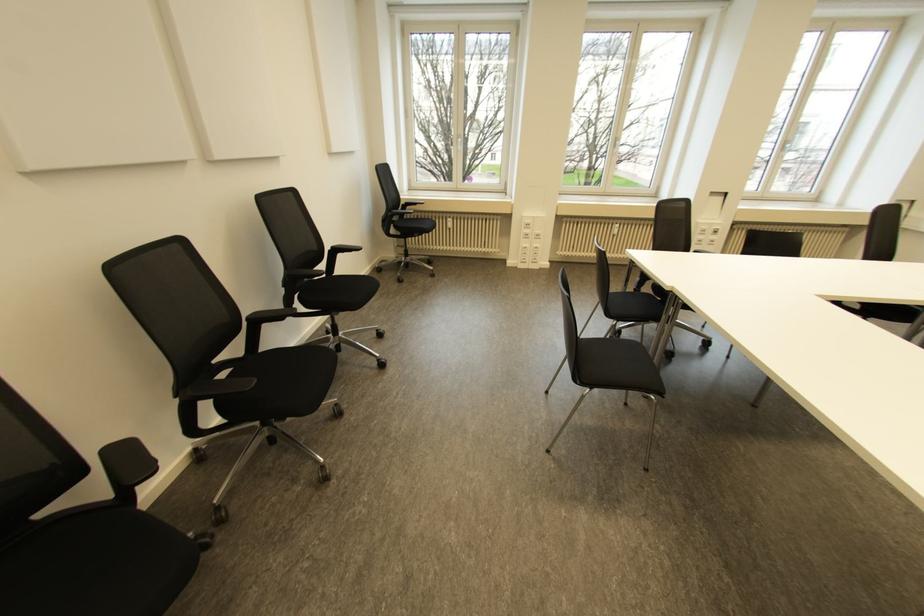
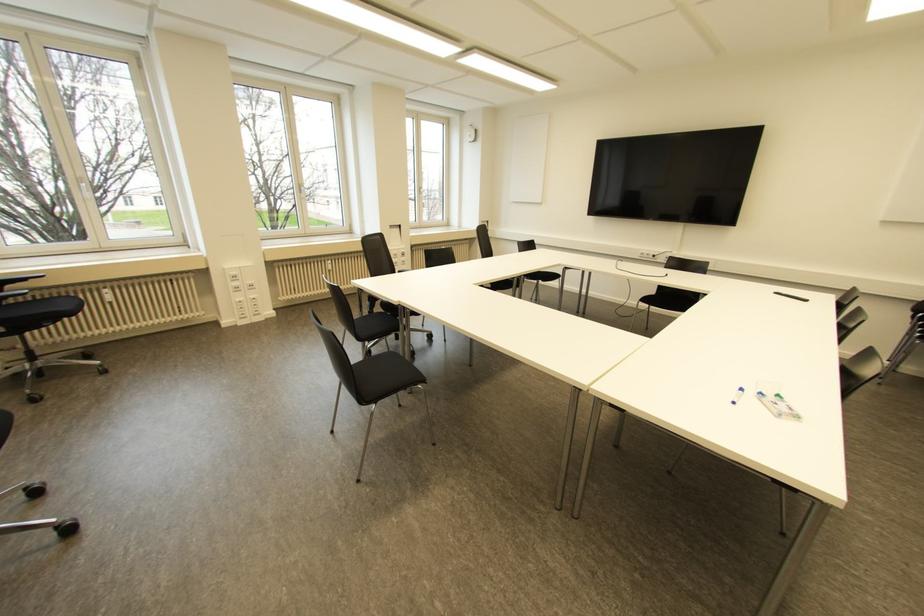
Question: How did the camera likely rotate?

Choices:
 (A) Left
 (B) Right
 (C) Up
 (D) Down

Answer: (B)